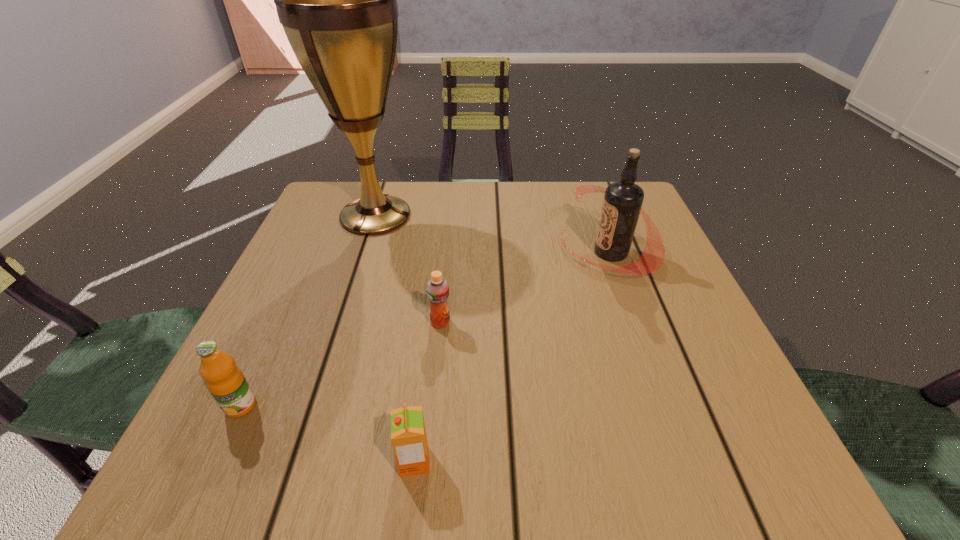
You are a GUI agent. You are given a task and a screenshot of the screen. Output one action in this format:
    pyautogui.click(x=<x>, y=<y>)
    Task: Click on the trophy cup
    This screenshot has width=960, height=540.
    Given the screenshot: What is the action you would take?
    pyautogui.click(x=337, y=0)

Image resolution: width=960 pixels, height=540 pixels. I want to click on root beer, so click(x=622, y=203).

This screenshot has width=960, height=540. Find the location of `the rightmost object`. the rightmost object is located at coordinates (622, 203).

Where is `the second farthest orange juice`? the second farthest orange juice is located at coordinates (226, 382).

Locate an element on the screen. This screenshot has width=960, height=540. the leftmost orange juice is located at coordinates (226, 382).

Find the location of a particular element. This screenshot has height=540, width=960. the third nearest object is located at coordinates (437, 288).

The width and height of the screenshot is (960, 540). I want to click on the nearest object, so click(408, 435).

What are the coordinates of `free space located on the right of the trophy cup` in the screenshot? It's located at (531, 216).

Where is `free space located 0.050m on the label of the rightmost object`? The width and height of the screenshot is (960, 540). free space located 0.050m on the label of the rightmost object is located at coordinates (538, 252).

At what (x,y) coordinates should I click in order to perform the action: click on vacant space located 0.240m on the label of the rightmost object. Please return your answer as a coordinate pair (x, y). The width and height of the screenshot is (960, 540). Looking at the image, I should click on (447, 252).